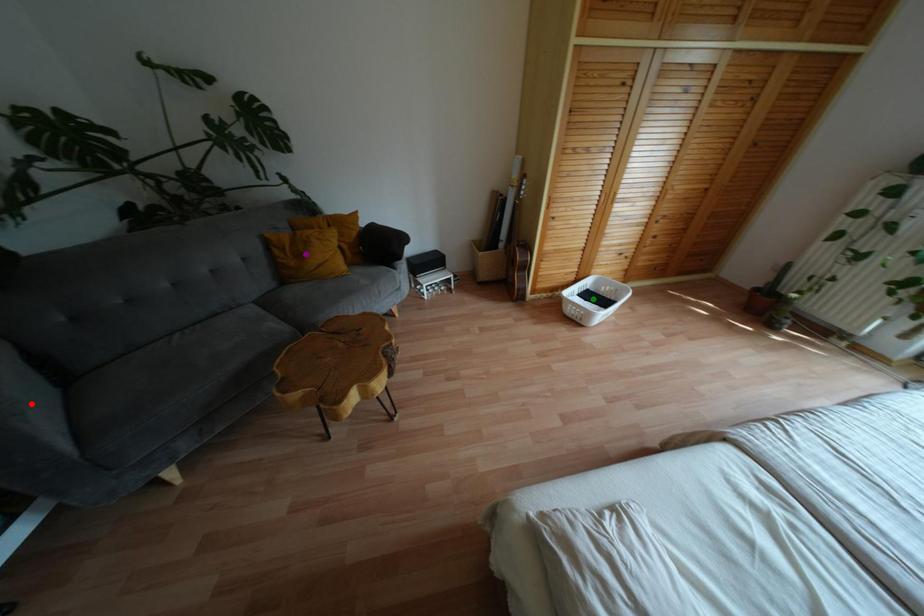
Order these from farthest to nearest:
A) red point
B) purple point
C) green point

1. green point
2. purple point
3. red point